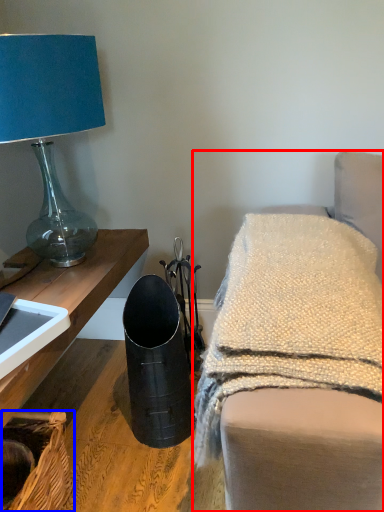
Question: Among these objects, which one is nearest to the camera, furniture (highlighted by a red box) or basket (highlighted by a blue box)?

Choices:
 (A) furniture
 (B) basket

Answer: (A)